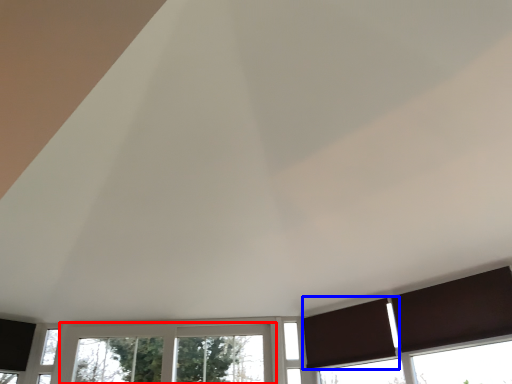
Question: Which point is closer to the camera, window (highlighted by a red box) or curtain (highlighted by a blue box)?

Choices:
 (A) window
 (B) curtain

Answer: (B)